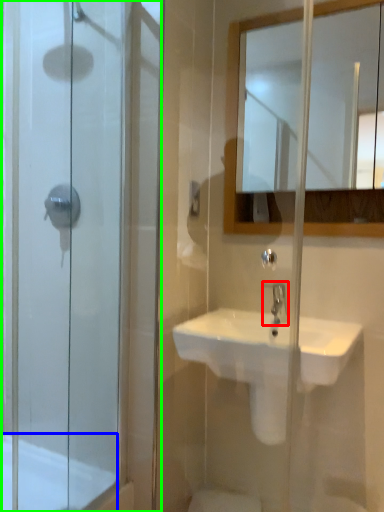
Question: Based on their relative distances, which object is farther from tap (highlighted by a red box)? Choose from bath (highlighted by a blue box) and screen door (highlighted by a green box).

Choices:
 (A) bath
 (B) screen door

Answer: (A)